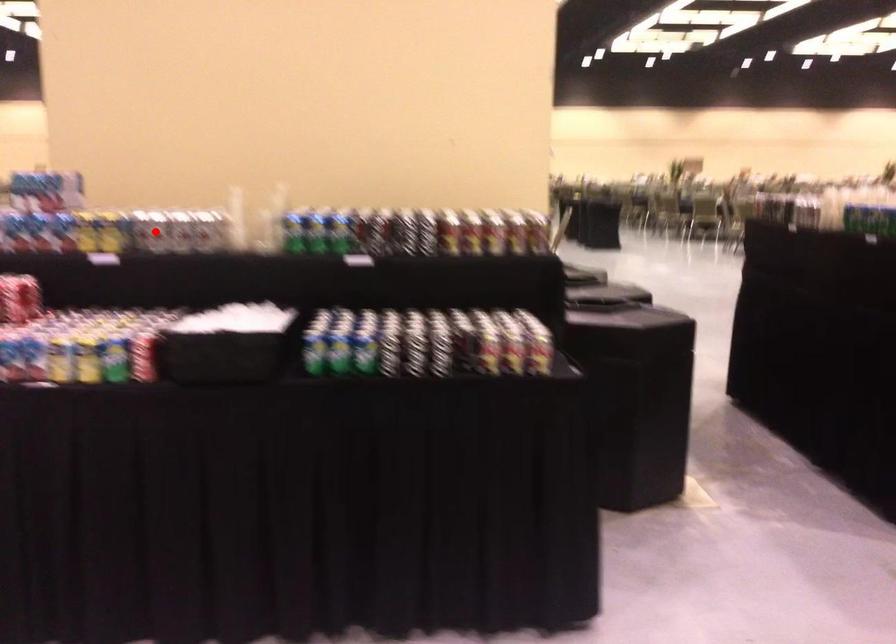
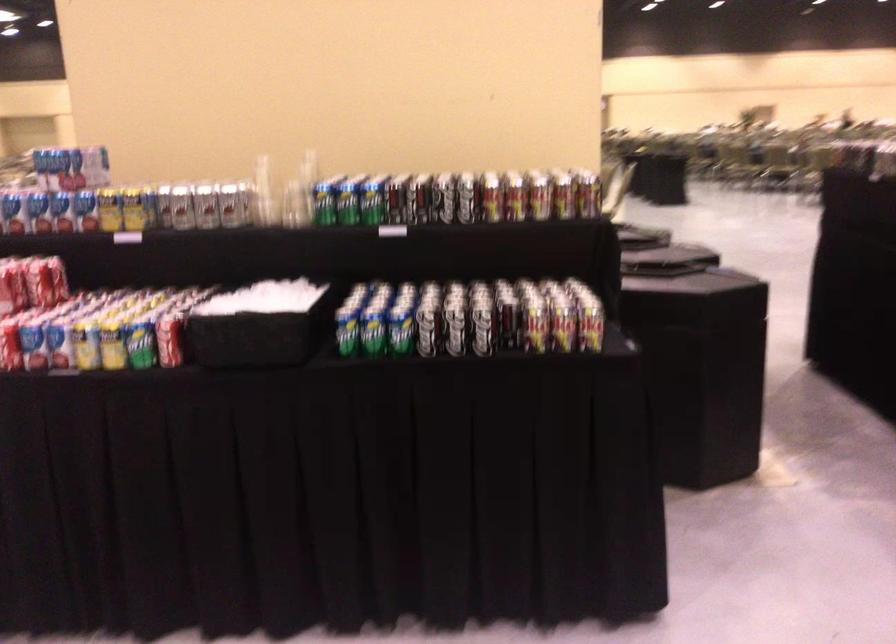
In the second image, find the point that corresponds to the highlighted location in the first image.

(182, 207)